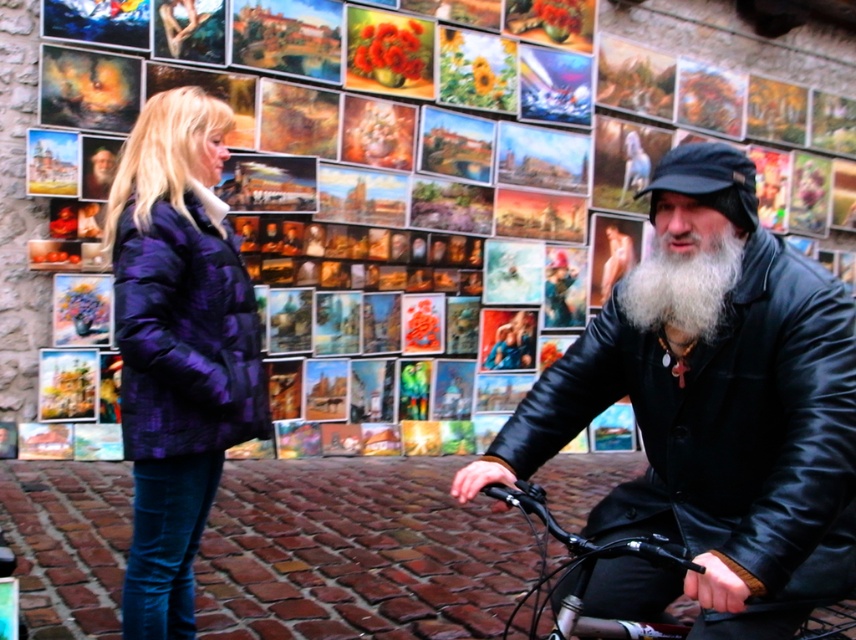
Which is in front, point (104, 241) or point (207, 444)?

Point (207, 444) is in front.

Can you confirm if purple quilted coat at left is positioned to the left of purple quilted jacket at left?

Correct, you'll find purple quilted coat at left to the left of purple quilted jacket at left.

Who is more forward, (x=203, y=476) or (x=156, y=273)?

Point (x=156, y=273)

The height and width of the screenshot is (640, 856). I want to click on purple quilted coat at left, so click(x=177, y=346).

Who is lower down, matte black bicycle at lower right or purple quilted coat at left?

purple quilted coat at left is lower down.

Is matte black bicycle at lower right bigger than purple quilted coat at left?

Incorrect, matte black bicycle at lower right is not larger than purple quilted coat at left.

Is point (595, 160) more distant than point (189, 417)?

Yes, point (595, 160) is behind point (189, 417).

Locate an element on the screen. Image resolution: width=856 pixels, height=640 pixels. matte black bicycle at lower right is located at coordinates (447, 150).

Is purple quilted coat at left positioned behind shiny black bicycle at center?

Yes.

Is point (141, 122) positioned in front of point (581, 593)?

That is False.

Where is `purple quilted coat at left`? This screenshot has height=640, width=856. purple quilted coat at left is located at coordinates (177, 346).